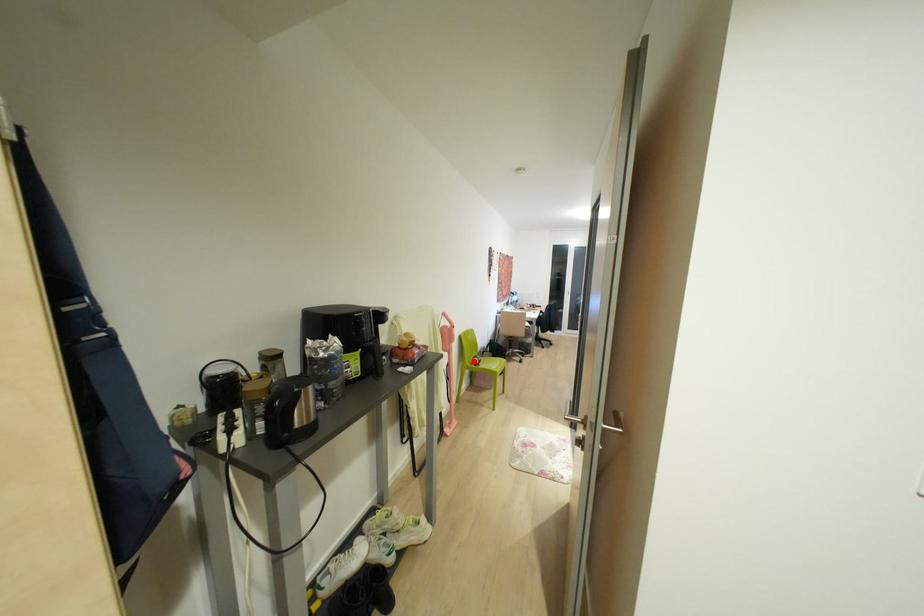
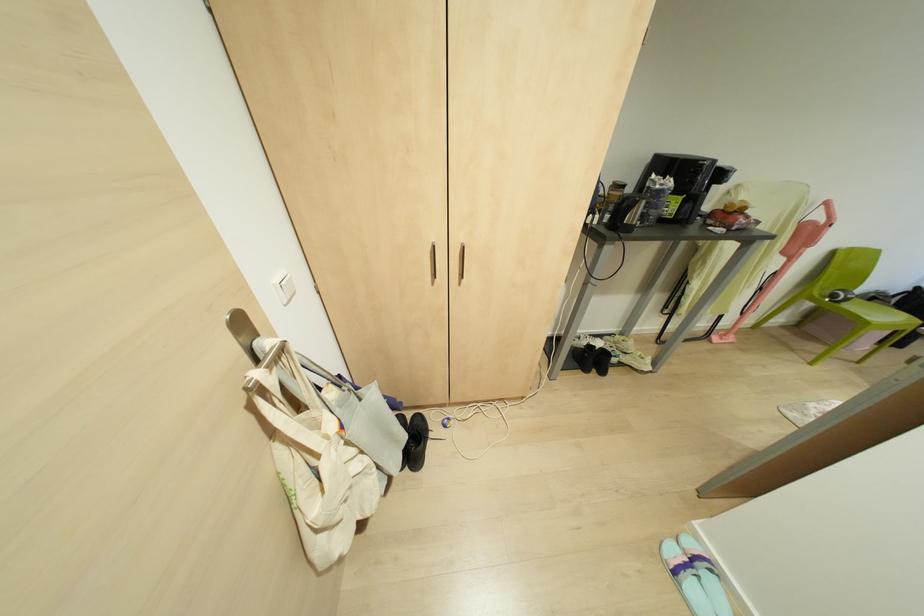
The point at the highlighted location is marked in the first image. Where is the corresponding point in the second image?

(833, 294)